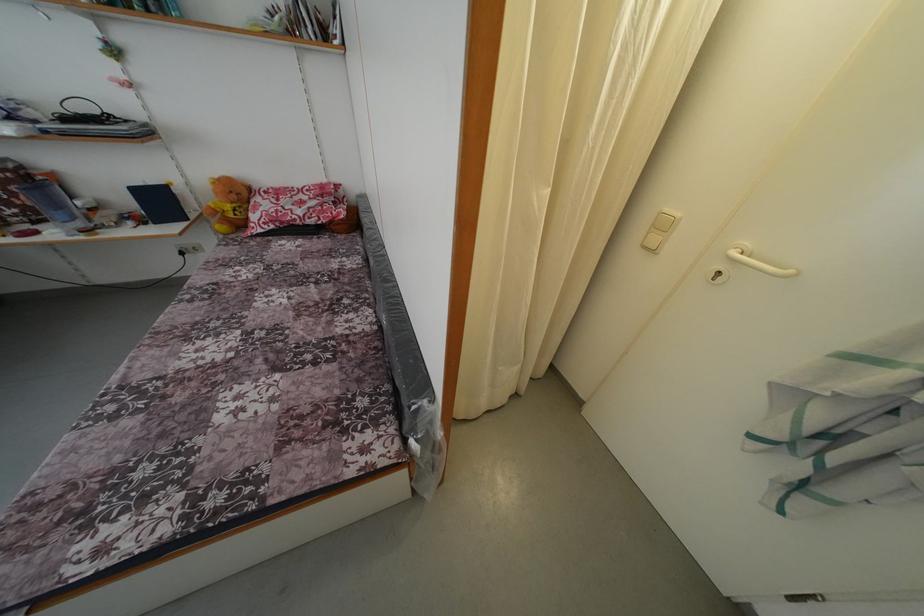
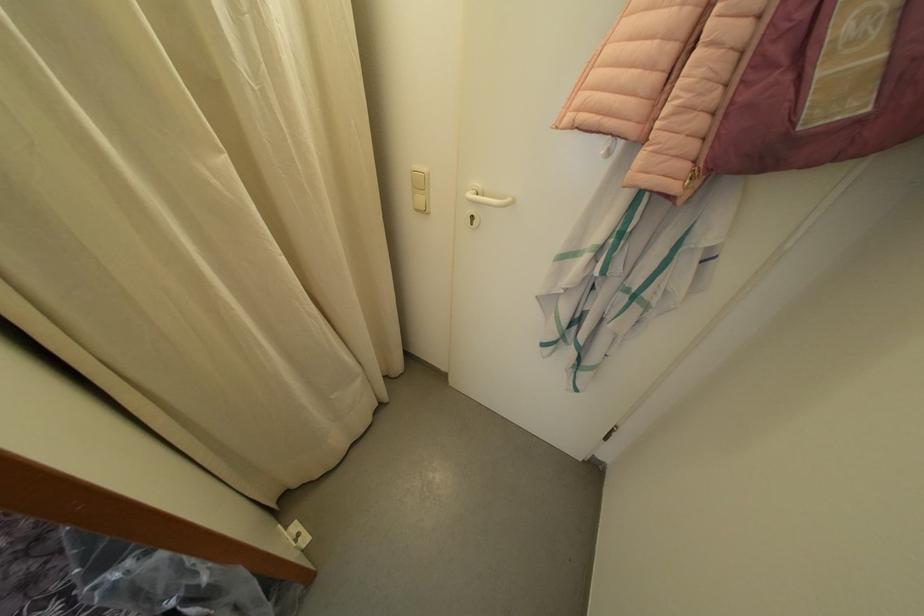
Locate, in the second image, the point that corresponds to point 669,233 in the first image.

(427, 191)